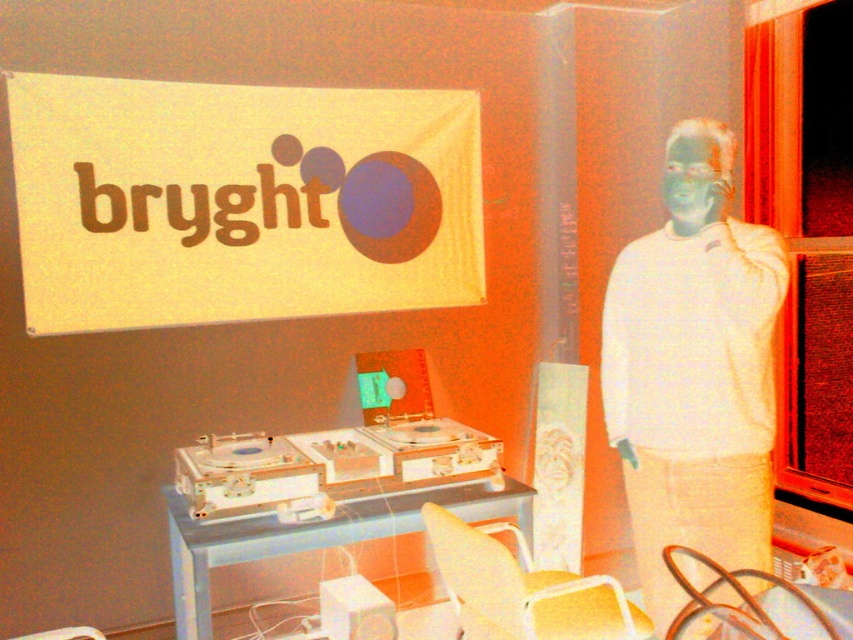
Question: Which point is closer to the camera?

Choices:
 (A) white fabric banner at upper left
 (B) white matte sweater at right

Answer: (B)

Question: Which point appears closest to the camera in this image?

Choices:
 (A) (184, 97)
 (B) (708, 554)

Answer: (B)

Question: Is white fabric banner at upper left below white matte sweater at right?

Choices:
 (A) no
 (B) yes

Answer: (A)

Question: Can you confirm if white fabric banner at upper left is positioned below white matte sweater at right?

Choices:
 (A) no
 (B) yes

Answer: (A)

Question: Is white fabric banner at upper left to the right of white matte sweater at right from the viewer's perspective?

Choices:
 (A) yes
 (B) no

Answer: (B)